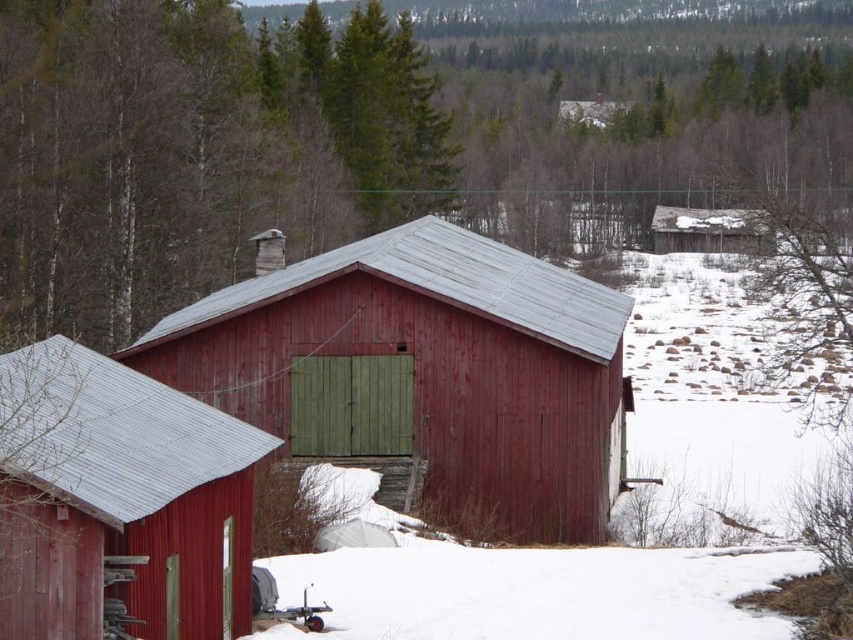
You are standing at the origin point in the image and want to walk to the matte red barn at left. According to the coordinates provided, in which direction should you move?

The matte red barn at left is located at point 0.784 on the x and 0.141 on the y. Since the origin is at the bottom left corner, you should move to the right and slightly upward to reach it.